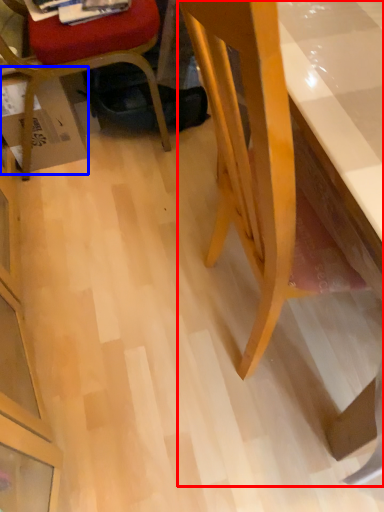
Question: Which point is further to the camera, desk (highlighted by a red box) or cardboard box (highlighted by a blue box)?

Choices:
 (A) desk
 (B) cardboard box

Answer: (B)